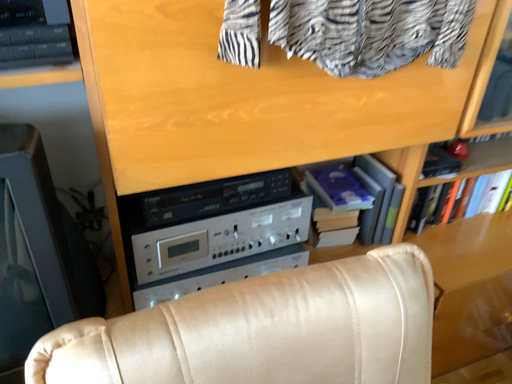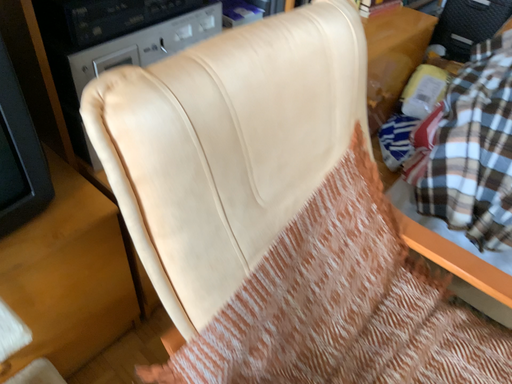
Question: Which way did the camera rotate in the video?

Choices:
 (A) rotated upward
 (B) rotated downward

Answer: (B)